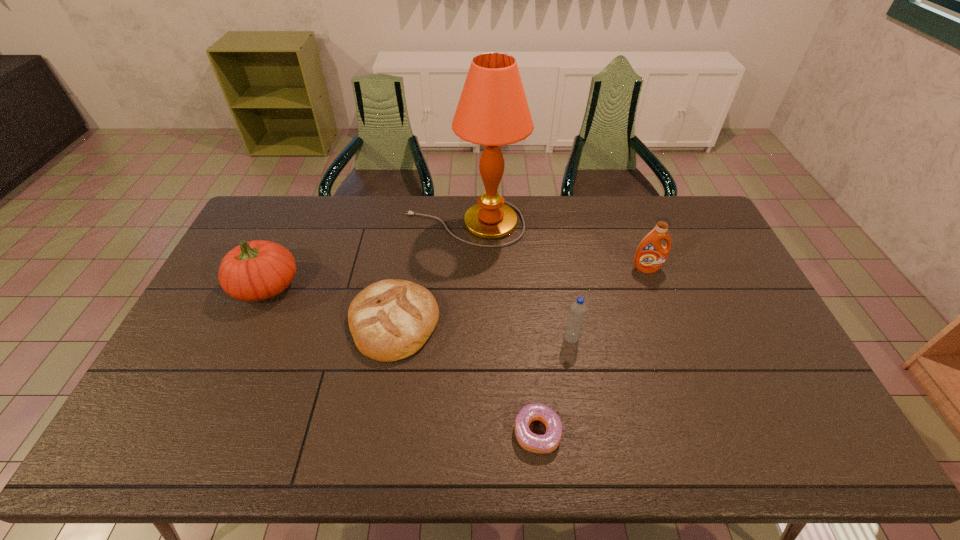
In the image, there is a desktop. Where is `free space at the right edge`? The width and height of the screenshot is (960, 540). free space at the right edge is located at coordinates (719, 296).

The image size is (960, 540). I want to click on vacant space at the far left corner, so click(x=261, y=214).

This screenshot has width=960, height=540. In the image, there is a desktop. In order to click on vacant space at the near left corner in this screenshot , I will do `click(191, 429)`.

Identify the location of free point between the rightmost object and the pumpkin. This screenshot has width=960, height=540. (456, 277).

Where is `free space between the leftmost object and the tallest object`? This screenshot has height=540, width=960. free space between the leftmost object and the tallest object is located at coordinates (365, 255).

I want to click on vacant area that lies between the fifth object from left to right and the bread, so click(483, 330).

Find the location of `free space between the pumpkin and the detergent`. free space between the pumpkin and the detergent is located at coordinates (456, 277).

Locate an element on the screen. This screenshot has height=540, width=960. vacant space that is in between the rightmost object and the leftmost object is located at coordinates [456, 277].

Locate an element on the screen. The width and height of the screenshot is (960, 540). vacant region between the detergent and the fifth tallest object is located at coordinates (520, 295).

Locate an element on the screen. vacant space that's between the tallest object and the leftmost object is located at coordinates (365, 255).